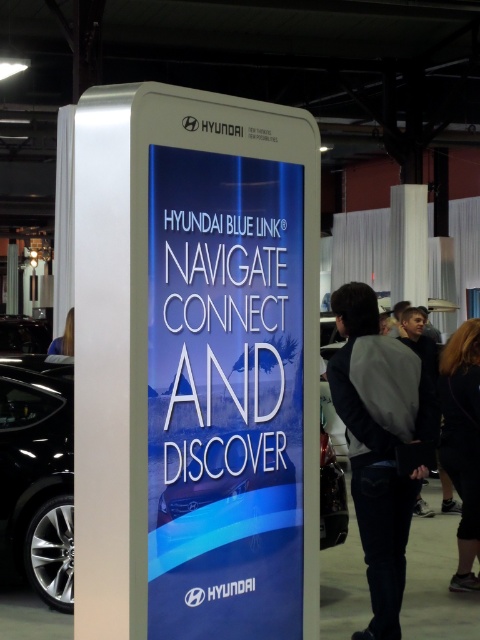
Can you confirm if dark gray jacket at center is taller than shiny black car at center?

Yes, dark gray jacket at center is taller than shiny black car at center.

Which is in front, point (350, 333) or point (72, 435)?

Positioned in front is point (350, 333).

Does point (358, 509) lie in front of point (10, 419)?

Yes, it is.

At what (x,y) coordinates should I click in order to perform the action: click on dark gray jacket at center. Please return your answer as a coordinate pair (x, y). This screenshot has height=640, width=480. Looking at the image, I should click on (379, 444).

Can you confirm if black metallic car at lower left is smaller than dark hair at lower right?

Actually, black metallic car at lower left might be larger than dark hair at lower right.

Between black metallic car at lower left and dark hair at lower right, which one appears on the right side from the viewer's perspective?

Positioned to the right is dark hair at lower right.

Where is `black metallic car at lower left`? This screenshot has height=640, width=480. black metallic car at lower left is located at coordinates (38, 472).

Does point (79, 396) come in front of point (25, 534)?

Yes, it is.

Can you confirm if white glossy sign at center is smaller than shiny black car at center?

Yes.

At what (x,y) coordinates should I click in order to perform the action: click on white glossy sign at center. Please return your answer as a coordinate pair (x, y). Looking at the image, I should click on (194, 365).

This screenshot has width=480, height=640. I want to click on white glossy sign at center, so click(194, 365).